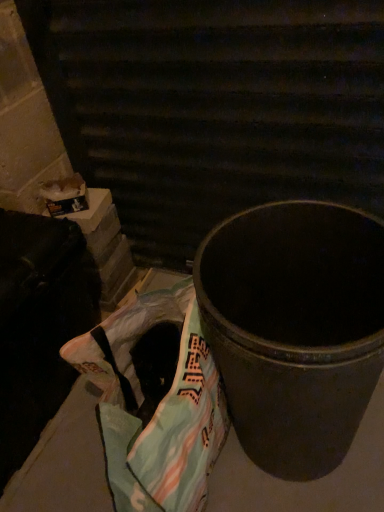
Measure the distance between plastic grocery bag at lower left and camera.

plastic grocery bag at lower left is 70.65 centimeters away from camera.

What is the approximate height of plastic grocery bag at lower left?

plastic grocery bag at lower left is 11.72 inches tall.

In order to face metallic black trash can at center, should I rotate leftwards or rightwards?

Rotate your view right by about 2.689°.

Measure the distance between metallic trash can at center and camera.

metallic trash can at center is 23.79 inches away from camera.

You are a GUI agent. You are given a task and a screenshot of the screen. Output one action in this format:
    pyautogui.click(x=<x>, y=<y>)
    Task: Click on the plastic grocery bag at lower left
    Image resolution: width=384 pixels, height=512 pixels.
    Given the screenshot: What is the action you would take?
    pyautogui.click(x=156, y=405)

Who is shorter, plastic grocery bag at lower left or metallic black trash can at center?

plastic grocery bag at lower left is shorter.

Does plastic grocery bag at lower left have a larger size compared to metallic black trash can at center?

No, plastic grocery bag at lower left is not bigger than metallic black trash can at center.

From a real-world perspective, is plastic grocery bag at lower left below metallic black trash can at center?

Yes, from a real-world perspective, plastic grocery bag at lower left is under metallic black trash can at center.

Is metallic black trash can at center further to camera compared to plastic grocery bag at lower left?

Yes.

From their relative heights in the image, would you say metallic black trash can at center is taller or shorter than plastic grocery bag at lower left?

metallic black trash can at center is taller than plastic grocery bag at lower left.

Between point (213, 56) and point (107, 439), which one is positioned behind?

Positioned behind is point (213, 56).

Is point (187, 284) closer to camera compared to point (233, 302)?

Yes.

Does plastic grocery bag at lower left have a greater width compared to metallic trash can at center?

No.

In the image, is plastic grocery bag at lower left positioned in front of or behind metallic trash can at center?

plastic grocery bag at lower left is behind metallic trash can at center.

From the image's perspective, is plastic grocery bag at lower left located above or below metallic trash can at center?

From the image's perspective, plastic grocery bag at lower left appears below metallic trash can at center.

The image size is (384, 512). What are the coordinates of `waste container on the right side of plastic grocery bag at lower left` in the screenshot? It's located at (295, 328).

Is the surface of metallic trash can at center in direct contact with plastic grocery bag at lower left?

No, metallic trash can at center is not beside plastic grocery bag at lower left.

Who is more distant, metallic trash can at center or plastic grocery bag at lower left?

plastic grocery bag at lower left is more distant.

In the scene shown: From the image's perspective, which one is positioned higher, metallic black trash can at center or metallic trash can at center?

metallic black trash can at center.

Between metallic black trash can at center and metallic trash can at center, which one has smaller width?

metallic black trash can at center.

Which is more to the right, metallic black trash can at center or metallic trash can at center?

Positioned to the right is metallic trash can at center.

Is metallic black trash can at center spatially inside metallic trash can at center, or outside of it?

metallic black trash can at center is not enclosed by metallic trash can at center.

Is point (256, 457) positioned before point (273, 150)?

Yes, it is in front of point (273, 150).

Considering the sizes of objects metallic trash can at center and metallic black trash can at center in the image provided, who is taller, metallic trash can at center or metallic black trash can at center?

metallic black trash can at center is taller.

Does metallic trash can at center have a lesser width compared to metallic black trash can at center?

Incorrect, the width of metallic trash can at center is not less than that of metallic black trash can at center.

Is metallic black trash can at center inside metallic trash can at center?

No, metallic trash can at center does not contain metallic black trash can at center.

You are a GUI agent. You are given a task and a screenshot of the screen. Output one action in this format:
    pyautogui.click(x=<x>, y=<y>)
    Task: Click on the grocery bag directly beneath the metallic black trash can at center (from a real-world perspective)
    
    Given the screenshot: What is the action you would take?
    pyautogui.click(x=156, y=405)

Where is `grocery bag that is below the metallic black trash can at center (from the image's perspective)`? This screenshot has height=512, width=384. grocery bag that is below the metallic black trash can at center (from the image's perspective) is located at coordinates (156, 405).

Looking at this image, considering their positions, is plastic grocery bag at lower left positioned closer to metallic trash can at center than metallic black trash can at center?

plastic grocery bag at lower left is closer to metallic trash can at center.

Based on their spatial positions, is metallic black trash can at center or metallic trash can at center further from plastic grocery bag at lower left?

metallic black trash can at center.

Which object lies nearer to the anchor point metallic black trash can at center, metallic trash can at center or plastic grocery bag at lower left?

metallic trash can at center.

Considering their positions, is metallic black trash can at center positioned further to metallic trash can at center than plastic grocery bag at lower left?

Among the two, metallic black trash can at center is located further to metallic trash can at center.

Considering their positions, is plastic grocery bag at lower left positioned further to metallic black trash can at center than metallic trash can at center?

plastic grocery bag at lower left lies further to metallic black trash can at center than the other object.

Based on their spatial positions, is metallic trash can at center or metallic black trash can at center further from plastic grocery bag at lower left?

metallic black trash can at center lies further to plastic grocery bag at lower left than the other object.

At what (x,y) coordinates should I click in order to perform the action: click on waste container between metallic black trash can at center and plastic grocery bag at lower left vertically. Please return your answer as a coordinate pair (x, y). The height and width of the screenshot is (512, 384). Looking at the image, I should click on (295, 328).